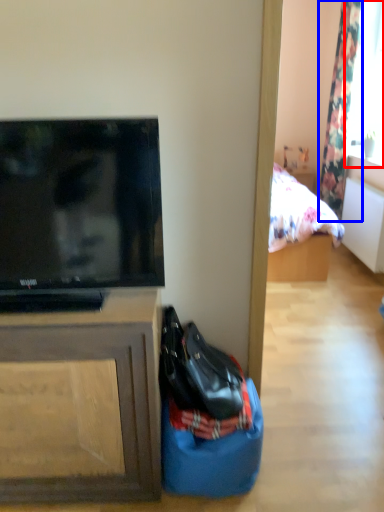
Question: Which object is further to the camera taking this photo, window screen (highlighted by a red box) or curtain (highlighted by a blue box)?

Choices:
 (A) window screen
 (B) curtain

Answer: (B)